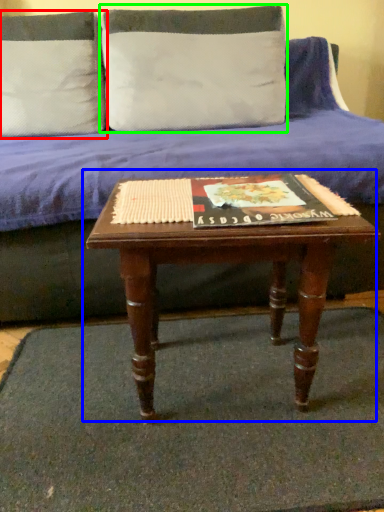
Question: Considering the real-world distances, which object is farthest from pillow (highlighted by a red box)? coffee table (highlighted by a blue box) or pillow (highlighted by a green box)?

Choices:
 (A) coffee table
 (B) pillow

Answer: (A)